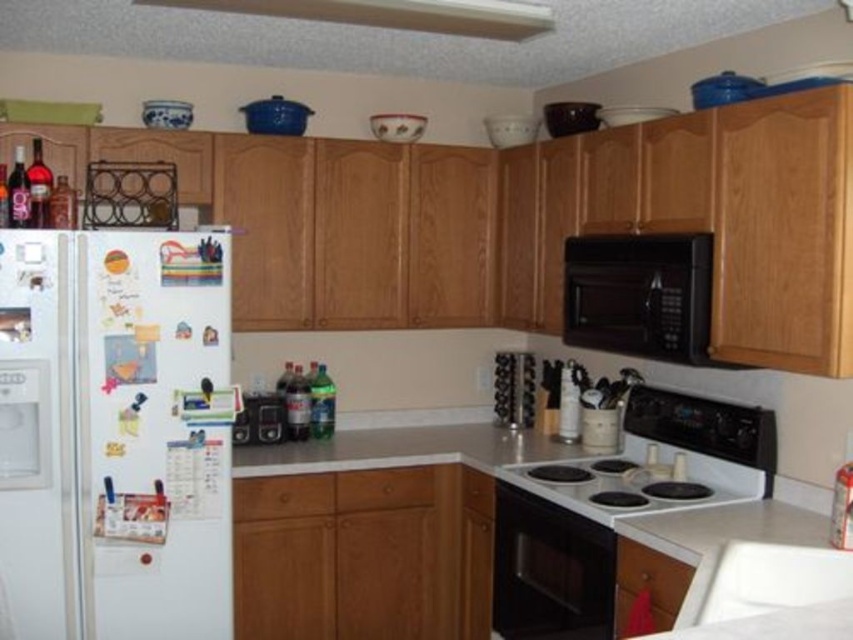
Does point (177, 524) come farther from viewer compared to point (498, 35)?

That is True.

Consider the image. Is white matte refrigerator at left to the left of white matte exhaust hood at upper center from the viewer's perspective?

Correct, you'll find white matte refrigerator at left to the left of white matte exhaust hood at upper center.

Describe the element at coordinates (115, 435) in the screenshot. I see `white matte refrigerator at left` at that location.

Where is `white matte refrigerator at left`? This screenshot has width=853, height=640. white matte refrigerator at left is located at coordinates (115, 435).

Can you confirm if white matte refrigerator at left is positioned below black matte microwave at upper center?

Yes.

Can you confirm if white matte refrigerator at left is wider than black matte microwave at upper center?

Yes, white matte refrigerator at left is wider than black matte microwave at upper center.

Is point (88, 625) closer to camera compared to point (659, 337)?

Yes, it is.

Find the location of `white matte refrigerator at left`. white matte refrigerator at left is located at coordinates coord(115,435).

Who is more forward, (x=618, y=339) or (x=741, y=483)?

Positioned in front is point (x=741, y=483).

Between point (648, 282) and point (662, 502), which one is positioned behind?

The point (648, 282) is more distant.

Identify the location of black matte microwave at upper center. The image size is (853, 640). (639, 294).